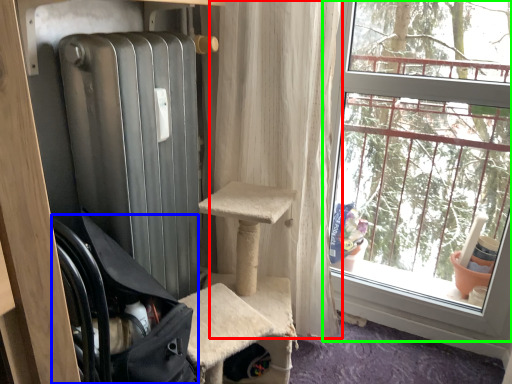
Question: Which object is positioned farthest from curtain (highlighted by a red box)? Select from chair (highlighted by a blue box) and window (highlighted by a green box).

Choices:
 (A) chair
 (B) window

Answer: (A)